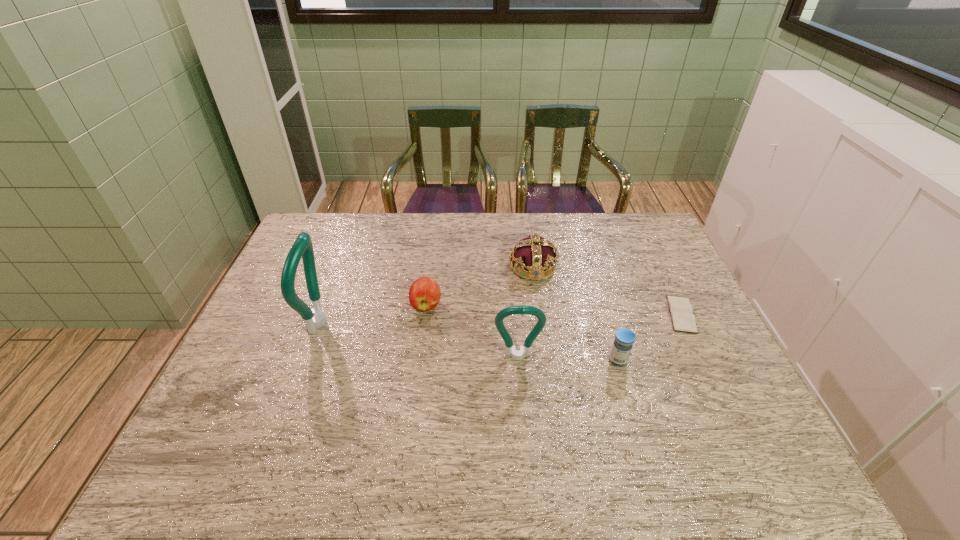
Find the location of `vacant space located 0.200m at the jaws of the leftmost object`. vacant space located 0.200m at the jaws of the leftmost object is located at coordinates (403, 322).

At what (x,y) coordinates should I click in order to perform the action: click on free space located 0.150m at the jaws of the fifth shortest object. Please return your answer as a coordinate pair (x, y). Image resolution: width=960 pixels, height=540 pixels. Looking at the image, I should click on (522, 416).

Find the location of `vacant space positioned on the front of the rightmost object`. vacant space positioned on the front of the rightmost object is located at coordinates (697, 348).

You are a GUI agent. You are given a task and a screenshot of the screen. Output one action in this format:
    pyautogui.click(x=<x>, y=<y>)
    Task: Click on the free space located 0.350m on the back of the apple
    This screenshot has width=960, height=540.
    Given the screenshot: What is the action you would take?
    pyautogui.click(x=436, y=228)

Where is `free space located on the right of the farthest object`? free space located on the right of the farthest object is located at coordinates (679, 267).

Where is `vacant space located 0.090m on the back of the medicine`? vacant space located 0.090m on the back of the medicine is located at coordinates (609, 328).

Identify the location of object present at the far edge. (534, 254).

Locate an element on the screen. The height and width of the screenshot is (540, 960). object that is at the left edge is located at coordinates (315, 318).

I want to click on object at the right edge, so click(x=681, y=310).

The height and width of the screenshot is (540, 960). Find the location of `vacant area at the far edge of the desktop`. vacant area at the far edge of the desktop is located at coordinates (567, 245).